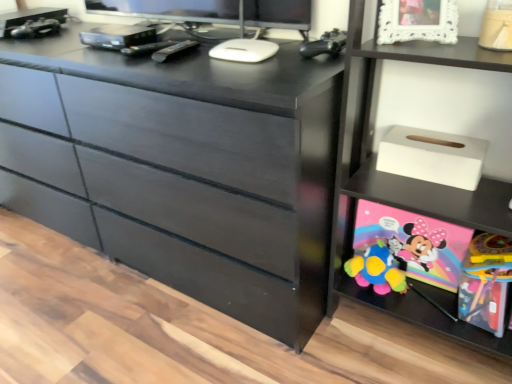
The height and width of the screenshot is (384, 512). In order to click on spots to the right of black plastic remote at center in this screenshot , I will do (231, 59).